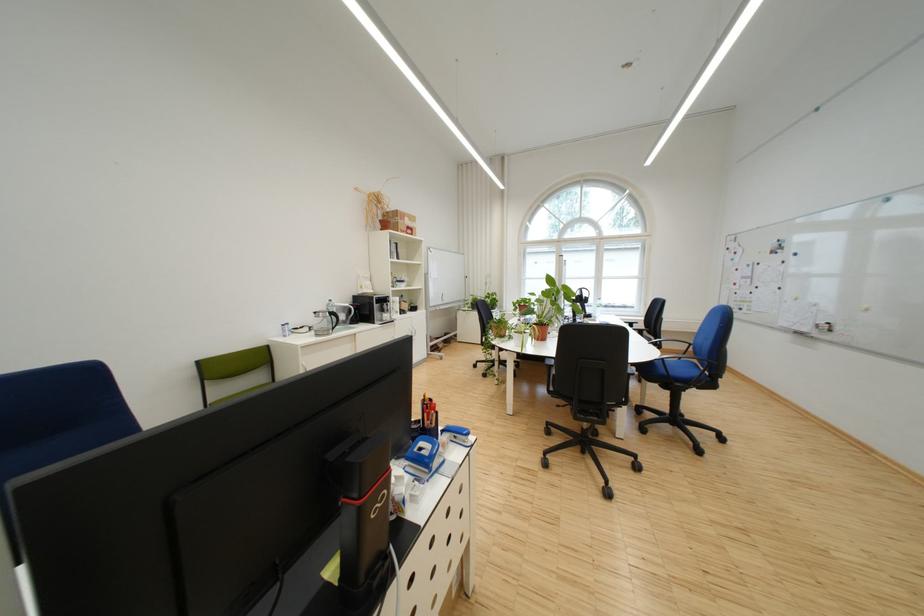
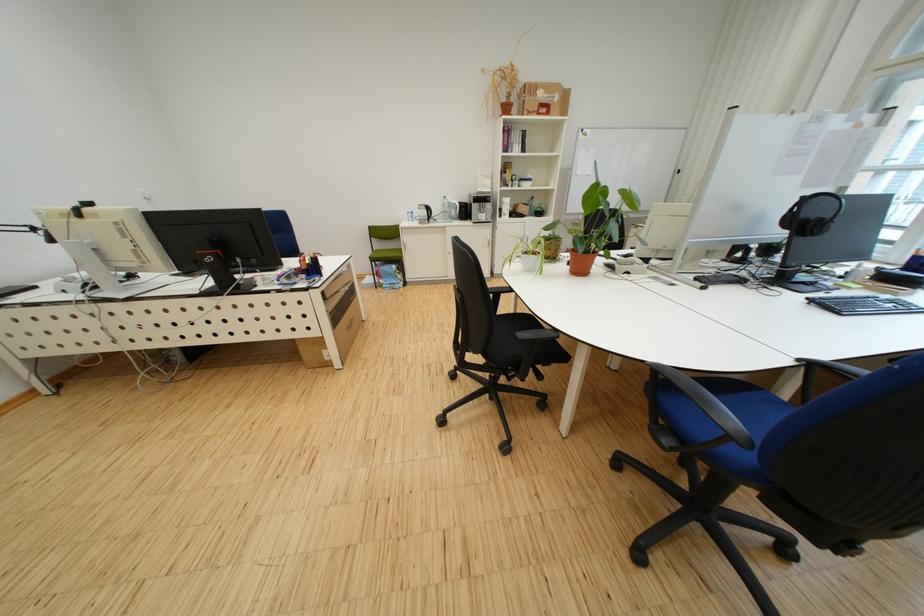
The point at (414, 233) is marked in the first image. Where is the corresponding point in the second image?

(541, 115)